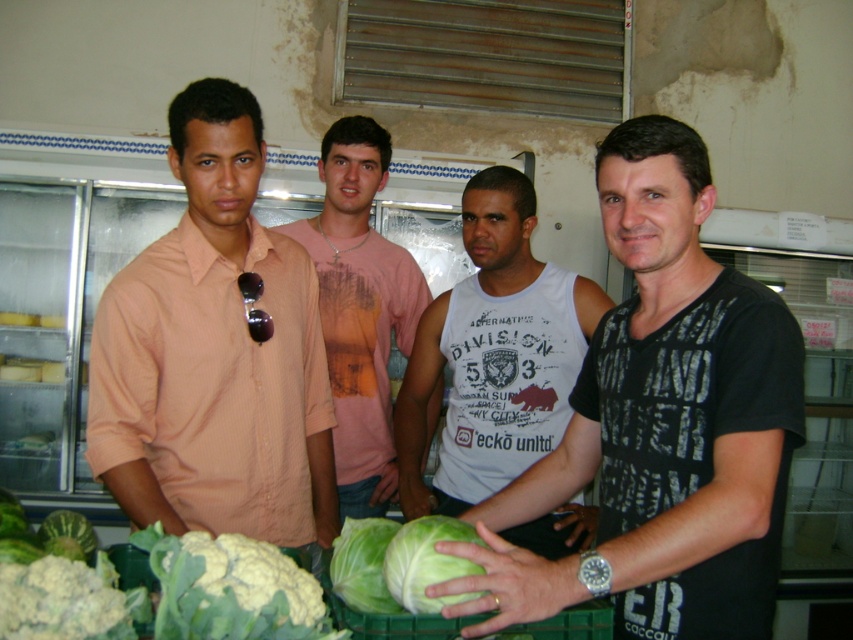
Is black printed t-shirt at center positioned at the back of matte peach shirt at left?

No, black printed t-shirt at center is in front of matte peach shirt at left.

At what (x,y) coordinates should I click in order to perform the action: click on black printed t-shirt at center. Please return your answer as a coordinate pair (x, y). The width and height of the screenshot is (853, 640). Looking at the image, I should click on (660, 426).

Does green matte cabbage at lower left lie behind green leafy cabbage at lower center?

That is False.

You are a GUI agent. You are given a task and a screenshot of the screen. Output one action in this format:
    pyautogui.click(x=<x>, y=<y>)
    Task: Click on the green matte cabbage at lower left
    This screenshot has width=853, height=640.
    Given the screenshot: What is the action you would take?
    pyautogui.click(x=61, y=602)

The height and width of the screenshot is (640, 853). Find the location of `green matte cabbage at lower left`. green matte cabbage at lower left is located at coordinates (61, 602).

Is black printed t-shirt at center to the right of green leafy cabbage at lower center from the viewer's perspective?

Yes, black printed t-shirt at center is to the right of green leafy cabbage at lower center.

Where is `black printed t-shirt at center`? black printed t-shirt at center is located at coordinates (660, 426).

Image resolution: width=853 pixels, height=640 pixels. I want to click on black printed t-shirt at center, so click(660, 426).